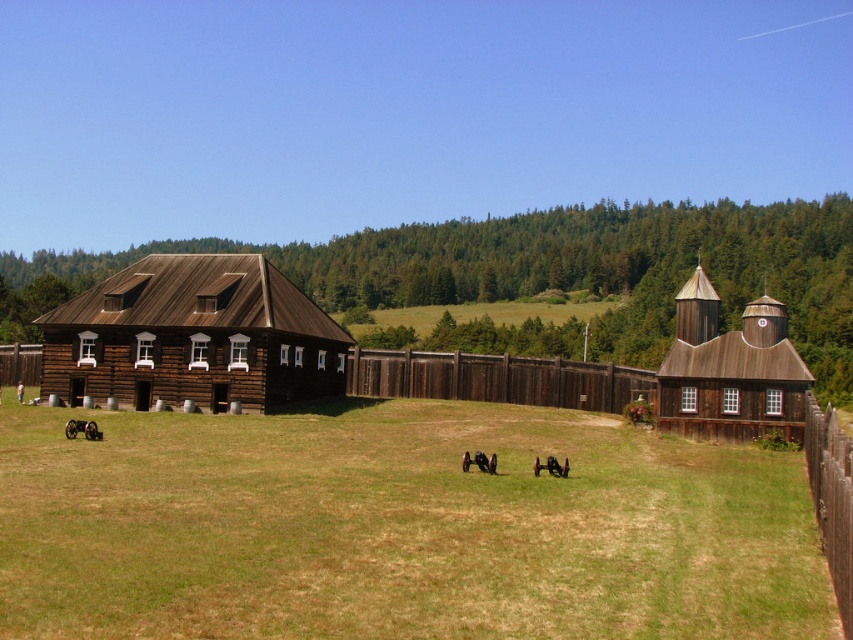
You are planning to set up a picnic area in the fenced area of the historical fort. The picnic area requires a space larger than the brown wooden barn at center. Can you determine if there is enough space for it using the green grass at center?

The green grass at center has a larger size compared to the brown wooden barn at center, so there is enough space for the picnic area since the green grass at center is bigger than the barn.

You are a soldier in the fort and need to move from the green grass at center to the brown wooden barn at center. Is there enough space to walk directly between them?

The green grass at center is wider than the brown wooden barn at center, so there is sufficient space to walk directly between them.